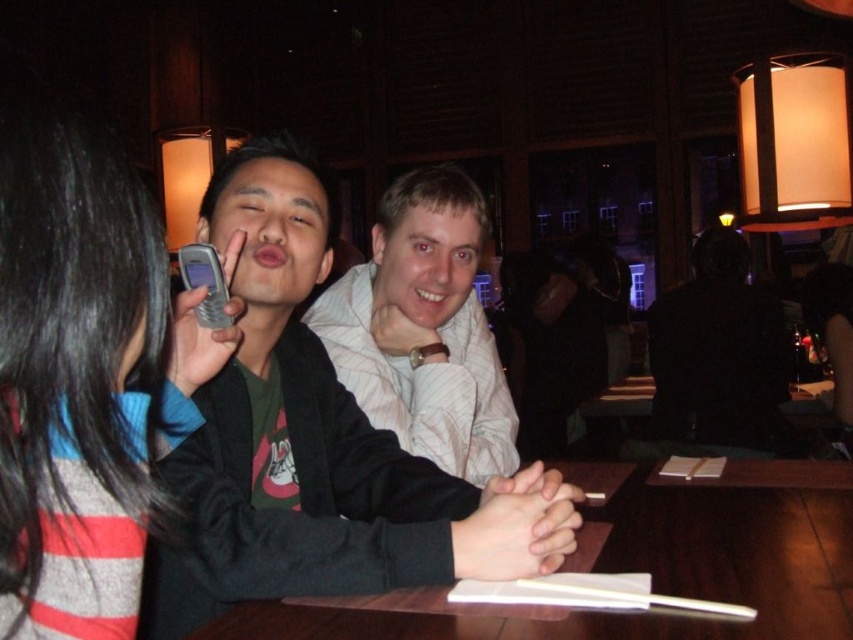
Question: Is matte black jacket at center to the left of white striped shirt at center from the viewer's perspective?

Choices:
 (A) no
 (B) yes

Answer: (B)

Question: Can you confirm if white striped shirt at center is wider than silver metallic phone at center?

Choices:
 (A) no
 (B) yes

Answer: (B)

Question: Which point appears farthest from the camera in this image?

Choices:
 (A) (334, 525)
 (B) (405, 438)
 (C) (146, 243)
 (D) (184, 269)

Answer: (B)

Question: Can you confirm if black matte jacket at center is smaller than silver metallic phone at center?

Choices:
 (A) yes
 (B) no

Answer: (B)

Question: Which of these objects is positioned closest to the white striped shirt at center?

Choices:
 (A) black matte jacket at center
 (B) silver metallic phone at center

Answer: (B)

Question: Among these points, which one is farthest from the camera?

Choices:
 (A) (401, 563)
 (B) (723, 433)
 (C) (483, 385)

Answer: (B)